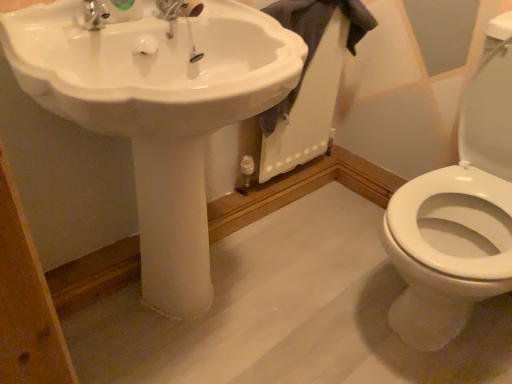
Question: Could you tell me if gray cotton towel at upper right is turned towards white glossy sink at center?

Choices:
 (A) no
 (B) yes

Answer: (A)

Question: Can you confirm if gray cotton towel at upper right is bigger than white glossy sink at center?

Choices:
 (A) no
 (B) yes

Answer: (A)

Question: Considering the relative positions of gray cotton towel at upper right and white glossy sink at center in the image provided, is gray cotton towel at upper right to the right of white glossy sink at center from the viewer's perspective?

Choices:
 (A) yes
 (B) no

Answer: (A)

Question: From a real-world perspective, does gray cotton towel at upper right sit lower than white glossy sink at center?

Choices:
 (A) yes
 (B) no

Answer: (B)

Question: From the image's perspective, is gray cotton towel at upper right located above white glossy sink at center?

Choices:
 (A) yes
 (B) no

Answer: (A)

Question: Is gray cotton towel at upper right looking in the opposite direction of white glossy sink at center?

Choices:
 (A) no
 (B) yes

Answer: (A)

Question: From a real-world perspective, is white glossy sink at center under gray cotton towel at upper right?

Choices:
 (A) yes
 (B) no

Answer: (A)

Question: Is white glossy sink at center beside gray cotton towel at upper right?

Choices:
 (A) yes
 (B) no

Answer: (B)

Question: Does white glossy sink at center have a greater width compared to gray cotton towel at upper right?

Choices:
 (A) yes
 (B) no

Answer: (A)

Question: Is white glossy sink at center further to the viewer compared to gray cotton towel at upper right?

Choices:
 (A) no
 (B) yes

Answer: (A)

Question: Can we say white glossy sink at center lies outside gray cotton towel at upper right?

Choices:
 (A) yes
 (B) no

Answer: (A)

Question: Does white glossy sink at center have a greater height compared to gray cotton towel at upper right?

Choices:
 (A) no
 (B) yes

Answer: (B)

Question: Is point (242, 56) positioned closer to the camera than point (308, 23)?

Choices:
 (A) farther
 (B) closer

Answer: (B)